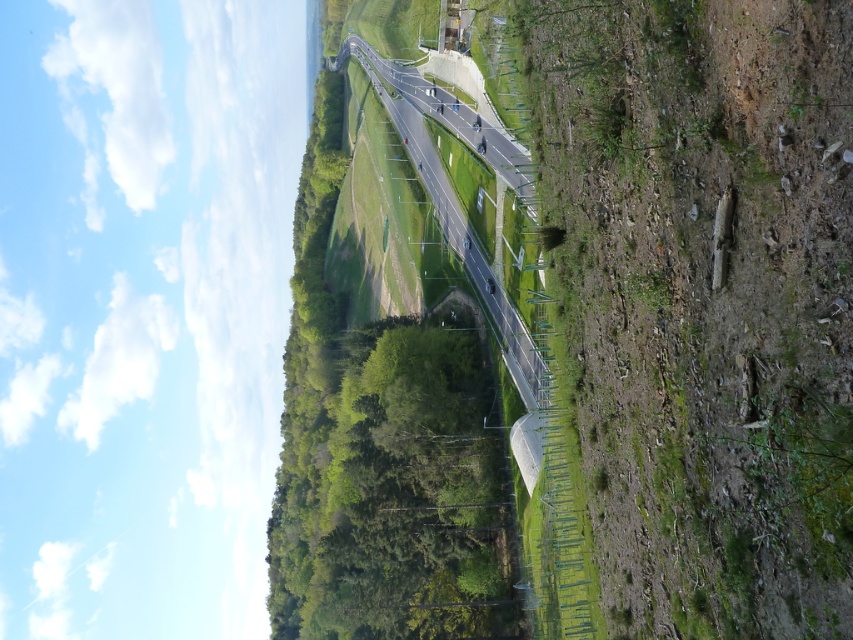
Question: Is dull green grass at lower right above asphalt road at center?

Choices:
 (A) yes
 (B) no

Answer: (B)

Question: Is dull green grass at lower right bigger than asphalt road at center?

Choices:
 (A) no
 (B) yes

Answer: (A)

Question: Is dull green grass at lower right smaller than asphalt road at center?

Choices:
 (A) no
 (B) yes

Answer: (B)

Question: Which of the following is the closest to the observer?

Choices:
 (A) asphalt road at center
 (B) dull green grass at lower right

Answer: (B)

Question: Which of the following is the closest to the observer?

Choices:
 (A) (753, 563)
 (B) (479, 108)

Answer: (A)